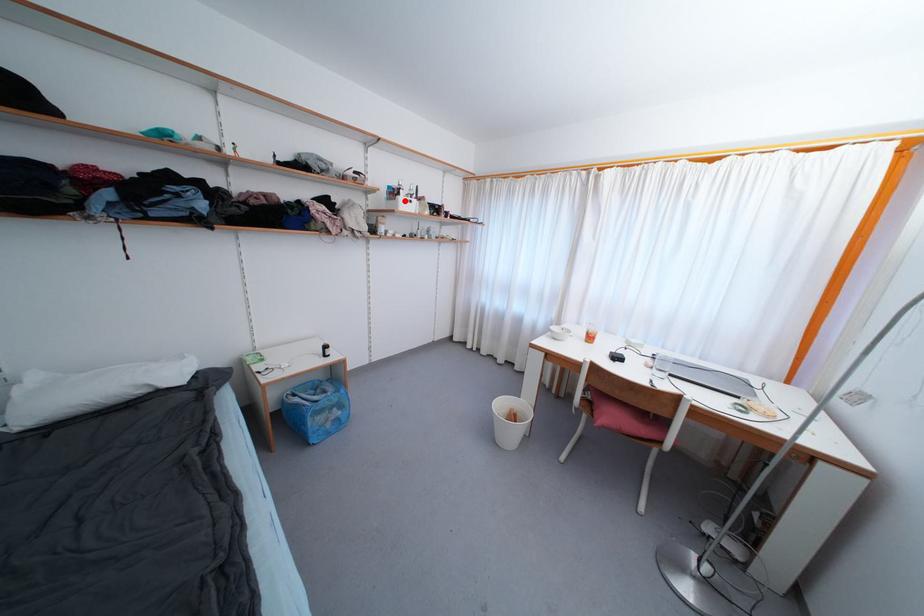
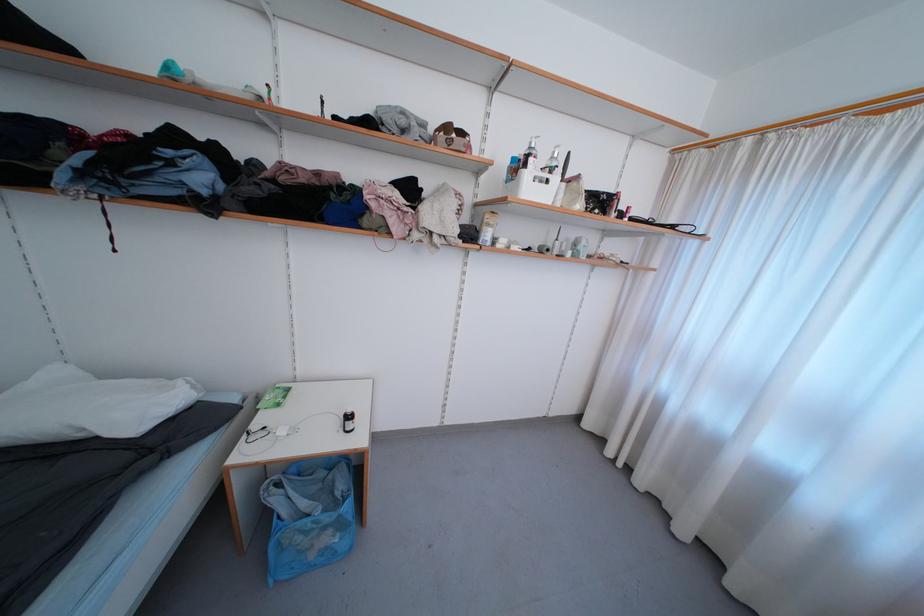
Where in the second image is the point corresponding to the highlighted location from the first image?

(531, 177)